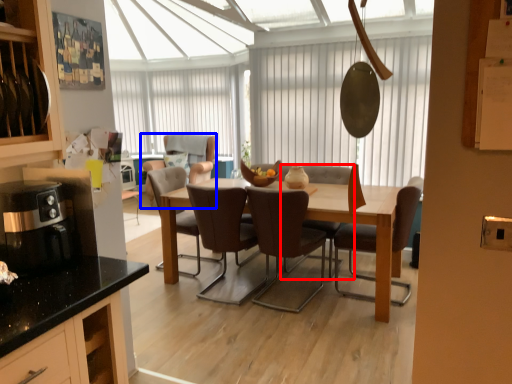
Question: Which point is closer to the camera, chair (highlighted by a red box) or chair (highlighted by a blue box)?

Choices:
 (A) chair
 (B) chair

Answer: (A)